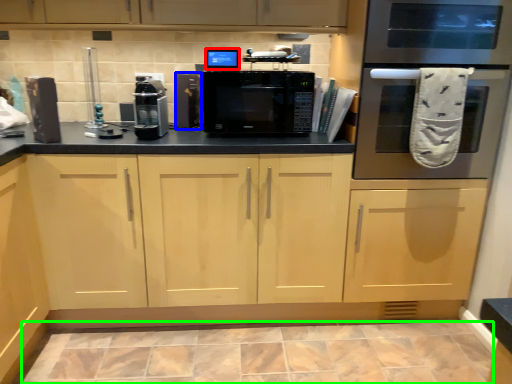
Question: Which object is the farthest from appliance (highlighted by a red box)? Choose among these: appliance (highlighted by a blue box) or ceramic tile (highlighted by a green box).

Choices:
 (A) appliance
 (B) ceramic tile

Answer: (B)